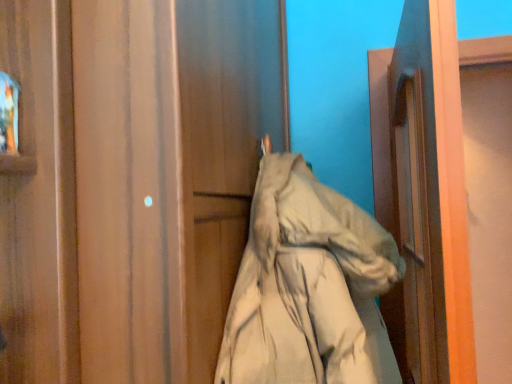
The width and height of the screenshot is (512, 384). I want to click on beige fabric coat at center, so click(x=308, y=287).

Describe the element at coordinates (8, 114) in the screenshot. The image size is (512, 384). I see `printed fabric at upper left` at that location.

What are the coordinates of `beige fabric coat at center` in the screenshot? It's located at (308, 287).

Are beige fabric coat at center and printed fabric at upper left located far from each other?

That's not correct — beige fabric coat at center is a little close to printed fabric at upper left.

From the picture: From the image's perspective, which object appears higher, beige fabric coat at center or printed fabric at upper left?

printed fabric at upper left.

Between point (309, 341) and point (3, 85), which one is positioned behind?

Point (309, 341)

From the image's perspective, is printed fabric at upper left above beige fabric coat at center?

Correct, printed fabric at upper left appears higher than beige fabric coat at center in the image.

Can you confirm if printed fabric at upper left is shorter than beige fabric coat at center?

Indeed, printed fabric at upper left has a lesser height compared to beige fabric coat at center.

Could you tell me if printed fabric at upper left is turned towards beige fabric coat at center?

No, printed fabric at upper left does not turn towards beige fabric coat at center.

In the scene shown: Which of these two, matte wood door at center or beige fabric coat at center, stands taller?

matte wood door at center is taller.

How many degrees apart are the facing directions of matte wood door at center and beige fabric coat at center?

There is a 5.11e-05-degree angle between the facing directions of matte wood door at center and beige fabric coat at center.

From a real-world perspective, between matte wood door at center and beige fabric coat at center, who is vertically higher?

In real-world perspective, matte wood door at center is above.

Which is more to the left, matte wood door at center or beige fabric coat at center?

From the viewer's perspective, matte wood door at center appears more on the left side.

Identify the location of person above the matte wood door at center (from a real-world perspective). Image resolution: width=512 pixels, height=384 pixels. pyautogui.click(x=8, y=114).

From the picture: Does printed fabric at upper left touch matte wood door at center?

There is a gap between printed fabric at upper left and matte wood door at center.

Considering the relative sizes of printed fabric at upper left and matte wood door at center in the image provided, is printed fabric at upper left thinner than matte wood door at center?

Yes.

Based on the photo, which is more to the right, matte wood door at center or printed fabric at upper left?

From the viewer's perspective, matte wood door at center appears more on the right side.

Which is further, (279, 26) or (5, 84)?

Point (279, 26)

How many degrees apart are the facing directions of matte wood door at center and printed fabric at upper left?

97.9 degrees separate the facing orientations of matte wood door at center and printed fabric at upper left.

Considering the relative sizes of matte wood door at center and printed fabric at upper left in the image provided, is matte wood door at center thinner than printed fabric at upper left?

In fact, matte wood door at center might be wider than printed fabric at upper left.

Considering the relative positions of beige fabric coat at center and matte wood door at center in the image provided, is beige fabric coat at center in front of matte wood door at center?

No, it is behind matte wood door at center.

Looking at this image, from the image's perspective, does beige fabric coat at center appear higher than matte wood door at center?

Incorrect, from the image's perspective, beige fabric coat at center is lower than matte wood door at center.

Who is shorter, beige fabric coat at center or matte wood door at center?

beige fabric coat at center.

Where is `coat below the matte wood door at center (from the image's perspective)`? This screenshot has height=384, width=512. coat below the matte wood door at center (from the image's perspective) is located at coordinates (308, 287).

Find the location of a particular element. This screenshot has width=512, height=384. person located above the beige fabric coat at center (from the image's perspective) is located at coordinates (8, 114).

This screenshot has width=512, height=384. Identify the location of person behind the beige fabric coat at center. (8, 114).

Estimate the real-world distances between objects in this image. Which object is closer to matte wood door at center, beige fabric coat at center or printed fabric at upper left?

Among the two, beige fabric coat at center is located nearer to matte wood door at center.

Looking at the image, which one is located closer to beige fabric coat at center, matte wood door at center or printed fabric at upper left?

Among the two, matte wood door at center is located nearer to beige fabric coat at center.

Looking at the image, which one is located closer to printed fabric at upper left, matte wood door at center or beige fabric coat at center?

matte wood door at center lies closer to printed fabric at upper left than the other object.

Considering their positions, is printed fabric at upper left positioned closer to matte wood door at center than beige fabric coat at center?

beige fabric coat at center.

Which object lies further to the anchor point printed fabric at upper left, beige fabric coat at center or matte wood door at center?

Based on the image, beige fabric coat at center appears to be further to printed fabric at upper left.

Looking at the image, which one is located further to beige fabric coat at center, printed fabric at upper left or matte wood door at center?

Based on the image, printed fabric at upper left appears to be further to beige fabric coat at center.

At what (x,y) coordinates should I click in order to perform the action: click on door between printed fabric at upper left and beige fabric coat at center from left to right. Please return your answer as a coordinate pair (x, y). This screenshot has height=384, width=512. Looking at the image, I should click on (131, 181).